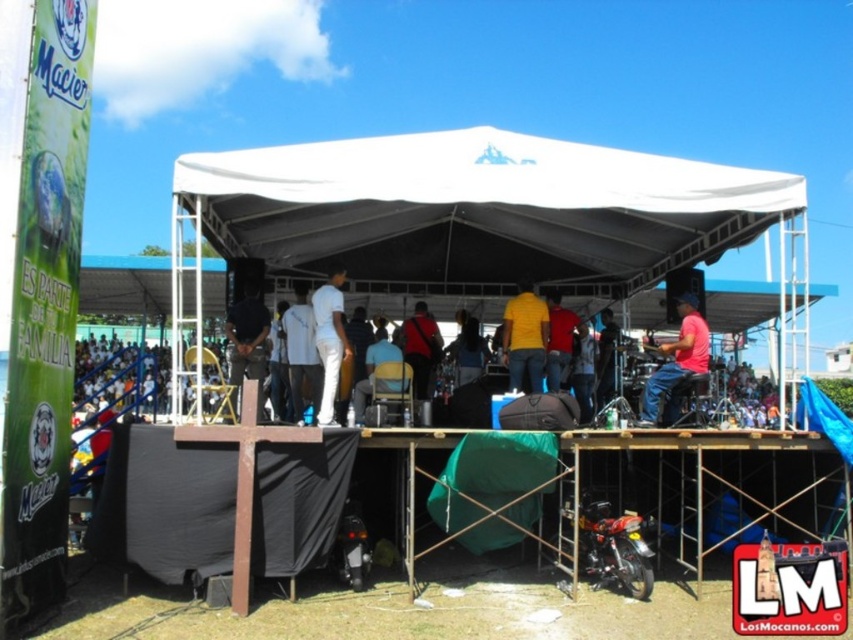
Question: Does pink fabric at center appear on the right side of dark blue shirt at center?

Choices:
 (A) no
 (B) yes

Answer: (B)

Question: Can you confirm if white fabric tent at center is positioned below white fabric shirt at center?

Choices:
 (A) yes
 (B) no

Answer: (B)

Question: Can you confirm if pink fabric at center is positioned above red matte shirt at center?

Choices:
 (A) no
 (B) yes

Answer: (A)

Question: Which point appears closest to the camera in this image?

Choices:
 (A) (247, 378)
 (B) (515, 304)

Answer: (A)

Question: Which of the following is the farthest from the observer?

Choices:
 (A) matte black shirt at center
 (B) white fabric shirt at center

Answer: (A)

Question: Estimate the real-world distances between objects in this image. Which object is closer to the red matte shirt at center?

Choices:
 (A) matte red shirt at center
 (B) white matte pants at center

Answer: (A)